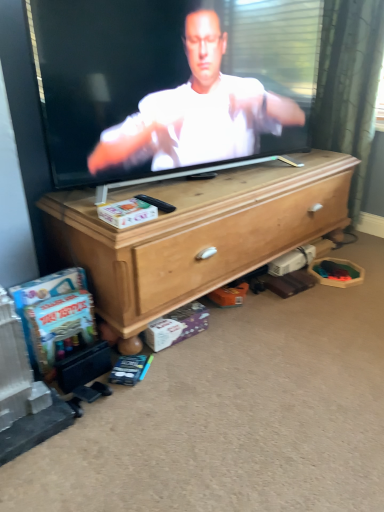
At what (x,y) coordinates should I click in order to perform the action: click on vacant area on top of wooden chest of drawers at center (from a real-world perspective). Please return your answer as a coordinate pair (x, y). This screenshot has height=512, width=384. Looking at the image, I should click on (230, 181).